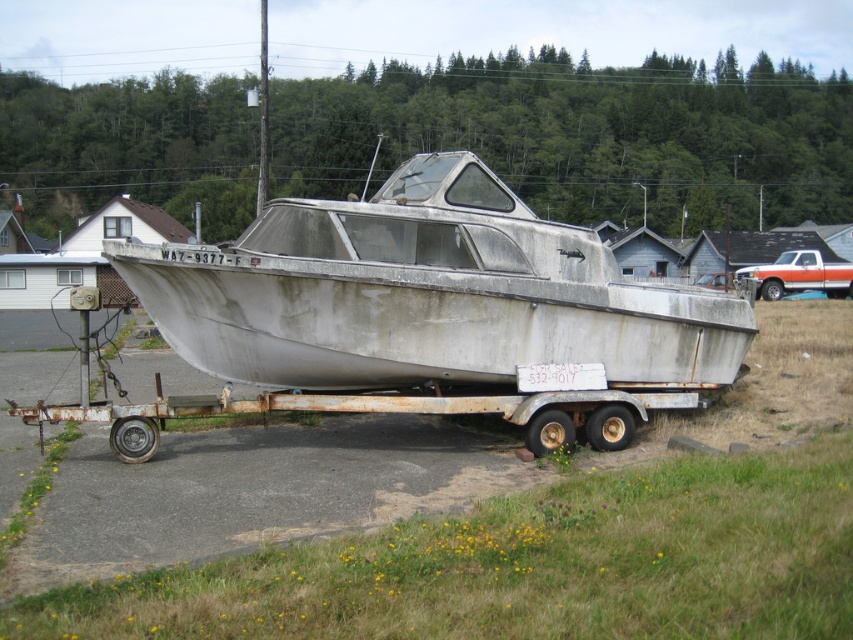
Question: Does rusty aluminum boat at center have a smaller size compared to rusty metal trailer at center?

Choices:
 (A) no
 (B) yes

Answer: (A)

Question: Does rusty aluminum boat at center have a greater width compared to rusty metal trailer at center?

Choices:
 (A) yes
 (B) no

Answer: (A)

Question: Which point is farther to the camera?

Choices:
 (A) rusty aluminum boat at center
 (B) rusty metal trailer at center

Answer: (B)

Question: Is rusty aluminum boat at center below rusty metal trailer at center?

Choices:
 (A) yes
 (B) no

Answer: (B)

Question: Which point is farther to the camera?

Choices:
 (A) (463, 400)
 (B) (694, 385)

Answer: (B)